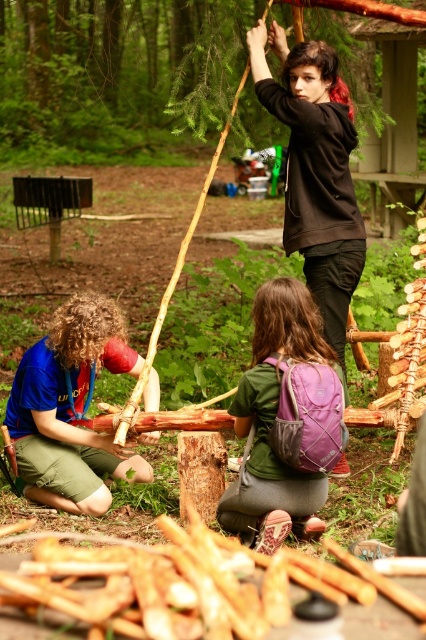
Who is lower down, green fabric backpack at center or black matte hoodie at upper center?

green fabric backpack at center is lower down.

What do you see at coordinates (284, 420) in the screenshot? I see `green fabric backpack at center` at bounding box center [284, 420].

This screenshot has height=640, width=426. Describe the element at coordinates (284, 420) in the screenshot. I see `green fabric backpack at center` at that location.

This screenshot has width=426, height=640. I want to click on green fabric backpack at center, so [x=284, y=420].

Between black matte hoodie at upper center and blue fabric shirt at lower left, which one appears on the left side from the viewer's perspective?

From the viewer's perspective, blue fabric shirt at lower left appears more on the left side.

Does point (362, 256) lie behind point (71, 486)?

That is True.

Locate an element on the screen. This screenshot has height=640, width=426. black matte hoodie at upper center is located at coordinates (316, 170).

Locate an element on the screen. This screenshot has height=640, width=426. green fabric backpack at center is located at coordinates (284, 420).

Does point (259, 442) come in front of point (43, 349)?

Yes, point (259, 442) is closer to viewer.

Where is `green fabric backpack at center`? This screenshot has width=426, height=640. green fabric backpack at center is located at coordinates (284, 420).